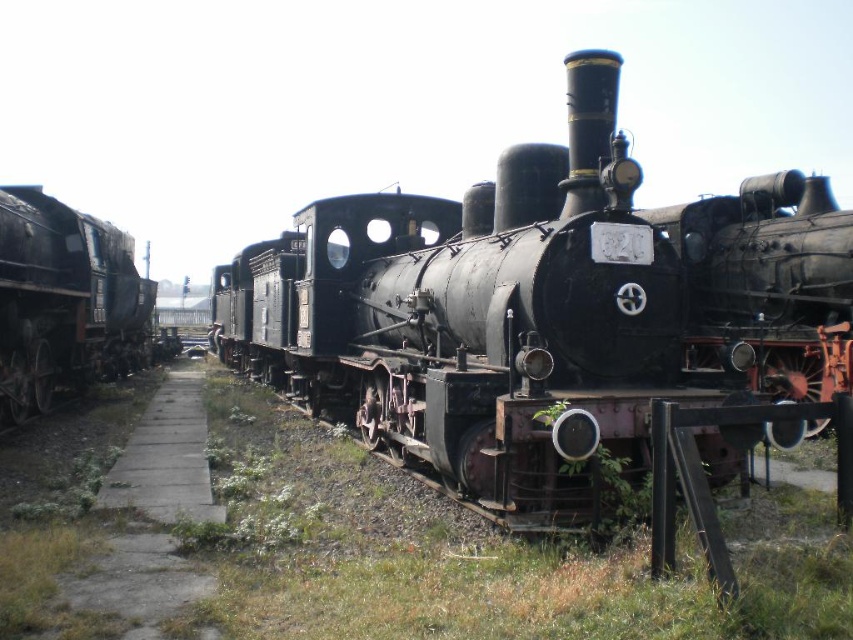
Question: Can you confirm if black matte locomotive at center is bigger than rusty metal train at left?

Choices:
 (A) yes
 (B) no

Answer: (A)

Question: Which of the following is the farthest from the observer?

Choices:
 (A) rusty metal train at left
 (B) black matte locomotive at center

Answer: (A)

Question: Is black matte locomotive at center to the left of rusty metal train at left from the viewer's perspective?

Choices:
 (A) yes
 (B) no

Answer: (B)

Question: Can you confirm if black matte locomotive at center is positioned to the left of rusty metal train at left?

Choices:
 (A) no
 (B) yes

Answer: (A)

Question: Which point is farther from the camera taking this photo?

Choices:
 (A) (570, 253)
 (B) (20, 266)

Answer: (B)